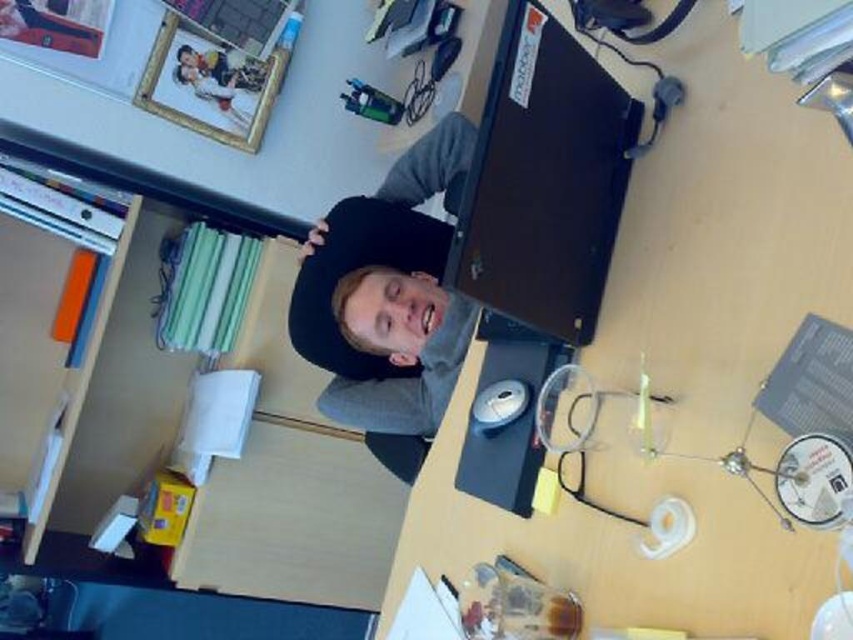
You are organizing items on a desk and need to place the matte black laptop at upper center next to the black matte cap at center. If the laptop is wider than the cap, which item should you place first to ensure they fit side by side?

The matte black laptop at upper center is wider than the black matte cap at center, so you should place the laptop first to accommodate its larger width before positioning the cap next to it.

You are looking at the desk from above. There are two points marked on the desk surface labeled as point (608, 104) and point (392, 221). Which point is closer to you?

Point (608, 104) is closer to the viewer than point (392, 221).